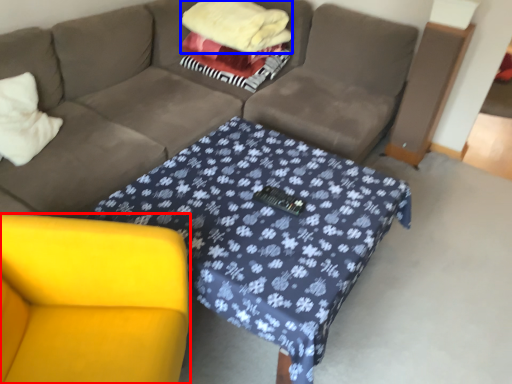
Question: Which object appears closest to the camera in this image, armchair (highlighted by a red box) or blanket (highlighted by a blue box)?

Choices:
 (A) armchair
 (B) blanket

Answer: (A)